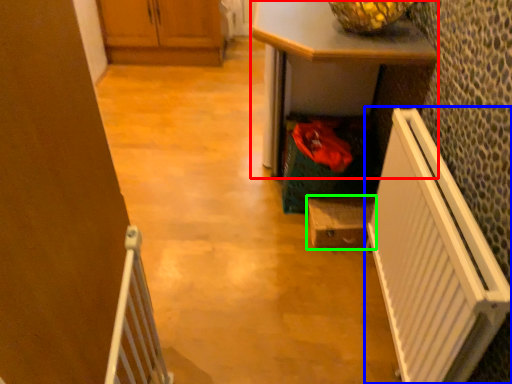
Question: Which is nearer to the desk (highlighted by a red box)? radiator (highlighted by a blue box) or cabinetry (highlighted by a green box).

Choices:
 (A) radiator
 (B) cabinetry

Answer: (A)